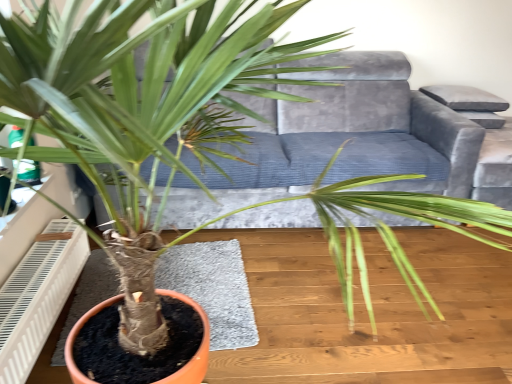
What do you see at coordinates (38, 296) in the screenshot?
I see `white plastic air conditioner at lower left` at bounding box center [38, 296].

Where is `velvet grey armchair at upper right`? velvet grey armchair at upper right is located at coordinates (484, 138).

Locate an element on the screen. The image size is (512, 384). velvet grey couch at center is located at coordinates (344, 139).

From a real-world perspective, does velvet grey armchair at upper right sit lower than white plastic air conditioner at lower left?

Incorrect, from a real-world perspective, velvet grey armchair at upper right is higher than white plastic air conditioner at lower left.

Which is behind, velvet grey armchair at upper right or white plastic air conditioner at lower left?

velvet grey armchair at upper right.

Looking at the image, does velvet grey armchair at upper right seem bigger or smaller compared to white plastic air conditioner at lower left?

velvet grey armchair at upper right is bigger than white plastic air conditioner at lower left.

Which of these two, velvet grey armchair at upper right or white plastic air conditioner at lower left, stands shorter?

With less height is white plastic air conditioner at lower left.

What's the angular difference between white plastic air conditioner at lower left and velvet grey couch at center's facing directions?

The angle between the facing direction of white plastic air conditioner at lower left and the facing direction of velvet grey couch at center is 89.3 degrees.

Do you think white plastic air conditioner at lower left is within velvet grey couch at center, or outside of it?

white plastic air conditioner at lower left is outside velvet grey couch at center.

Is white plastic air conditioner at lower left next to velvet grey couch at center and touching it?

white plastic air conditioner at lower left and velvet grey couch at center are clearly separated.

From the image's perspective, which is above, white plastic air conditioner at lower left or velvet grey couch at center?

velvet grey couch at center is shown above in the image.

I want to click on couch on the right of white plastic air conditioner at lower left, so click(344, 139).

Would you say velvet grey couch at center is to the left or to the right of white plastic air conditioner at lower left in the picture?

From the image, it's evident that velvet grey couch at center is to the right of white plastic air conditioner at lower left.

Is velvet grey couch at center not near white plastic air conditioner at lower left?

That's right, there is a large distance between velvet grey couch at center and white plastic air conditioner at lower left.

From the image's perspective, which one is positioned higher, velvet grey couch at center or white plastic air conditioner at lower left?

velvet grey couch at center is shown above in the image.

Based on the photo, is velvet grey armchair at upper right placed right next to velvet grey couch at center?

velvet grey armchair at upper right and velvet grey couch at center are clearly separated.

Who is smaller, velvet grey armchair at upper right or velvet grey couch at center?

velvet grey armchair at upper right.

Which is in front, point (426, 111) or point (489, 194)?

Positioned in front is point (489, 194).

From the picture: Are velvet grey couch at center and velvet grey armchair at upper right far apart?

No.

Which is more to the left, velvet grey couch at center or velvet grey armchair at upper right?

velvet grey couch at center.

Is velvet grey couch at center inside or outside of velvet grey armchair at upper right?

velvet grey couch at center cannot be found inside velvet grey armchair at upper right.

Does white plastic air conditioner at lower left have a lesser height compared to velvet grey armchair at upper right?

Correct, white plastic air conditioner at lower left is not as tall as velvet grey armchair at upper right.

How distant is white plastic air conditioner at lower left from velvet grey armchair at upper right?

white plastic air conditioner at lower left is 7.52 feet away from velvet grey armchair at upper right.

From a real-world perspective, is white plastic air conditioner at lower left physically above velvet grey armchair at upper right?

Incorrect, from a real-world perspective, white plastic air conditioner at lower left is lower than velvet grey armchair at upper right.

Is white plastic air conditioner at lower left wider than velvet grey armchair at upper right?

No, white plastic air conditioner at lower left is not wider than velvet grey armchair at upper right.

Where is `armchair located above the white plastic air conditioner at lower left (from the image's perspective)`? armchair located above the white plastic air conditioner at lower left (from the image's perspective) is located at coordinates (484, 138).

The image size is (512, 384). Find the location of `air conditioner located in front of the velvet grey couch at center`. air conditioner located in front of the velvet grey couch at center is located at coordinates (38, 296).

Based on their spatial positions, is velvet grey armchair at upper right or white plastic air conditioner at lower left further from velvet grey couch at center?

white plastic air conditioner at lower left lies further to velvet grey couch at center than the other object.

Which object lies further to the anchor point white plastic air conditioner at lower left, velvet grey armchair at upper right or velvet grey couch at center?

velvet grey armchair at upper right lies further to white plastic air conditioner at lower left than the other object.

Considering their positions, is velvet grey couch at center positioned closer to white plastic air conditioner at lower left than velvet grey armchair at upper right?

velvet grey couch at center is positioned closer to the anchor white plastic air conditioner at lower left.

When comparing their distances from velvet grey armchair at upper right, does velvet grey couch at center or white plastic air conditioner at lower left seem further?

Among the two, white plastic air conditioner at lower left is located further to velvet grey armchair at upper right.

Estimate the real-world distances between objects in this image. Which object is closer to velvet grey couch at center, white plastic air conditioner at lower left or velvet grey armchair at upper right?

The object closer to velvet grey couch at center is velvet grey armchair at upper right.

From the image, which object appears to be nearer to velvet grey armchair at upper right, white plastic air conditioner at lower left or velvet grey couch at center?

The object closer to velvet grey armchair at upper right is velvet grey couch at center.

At what (x,y) coordinates should I click in order to perform the action: click on couch located between white plastic air conditioner at lower left and velvet grey armchair at upper right in the left-right direction. Please return your answer as a coordinate pair (x, y). This screenshot has width=512, height=384. Looking at the image, I should click on pyautogui.click(x=344, y=139).